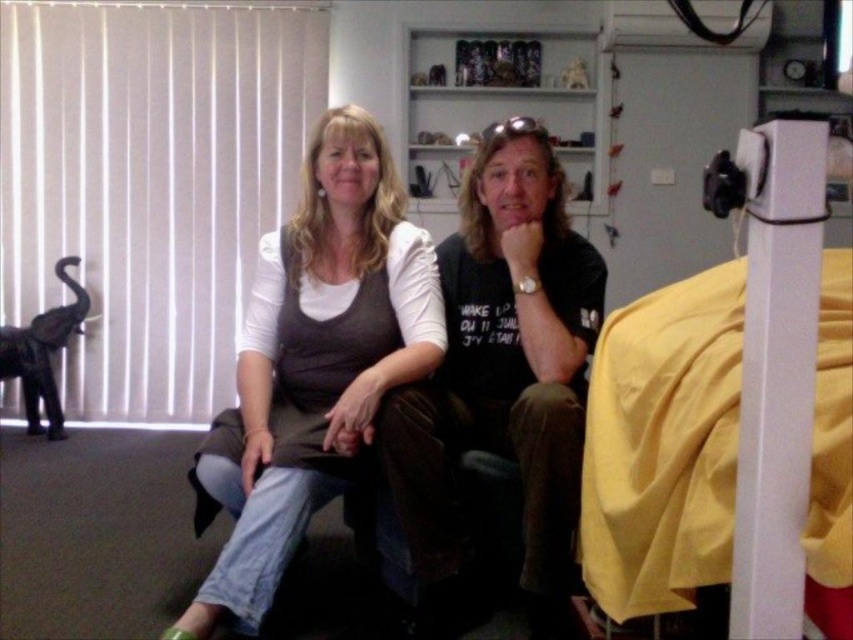
Between matte gray sweater at center and matte black t-shirt at center, which one has more height?

matte gray sweater at center is taller.

Who is positioned more to the left, matte gray sweater at center or matte black t-shirt at center?

matte gray sweater at center is more to the left.

Is point (247, 323) closer to camera compared to point (500, 250)?

That is True.

I want to click on matte gray sweater at center, so click(x=312, y=365).

Between yellow fabric bed at right and matte gray sweater at center, which one is positioned lower?

matte gray sweater at center is lower down.

Who is positioned more to the left, yellow fabric bed at right or matte gray sweater at center?

From the viewer's perspective, matte gray sweater at center appears more on the left side.

Image resolution: width=853 pixels, height=640 pixels. What are the coordinates of `yellow fabric bed at right` in the screenshot? It's located at (730, 412).

Is point (776, 572) farther from viewer compared to point (538, 436)?

No, (776, 572) is closer to viewer.

Locate an element on the screen. The width and height of the screenshot is (853, 640). yellow fabric bed at right is located at coordinates (730, 412).